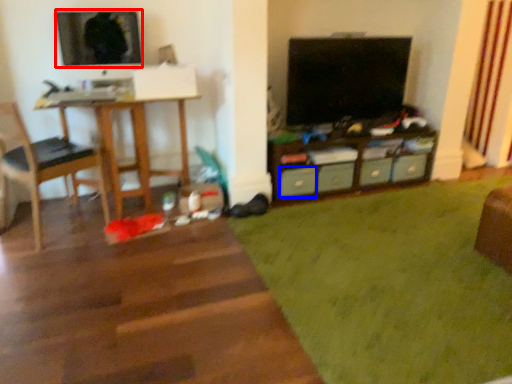
Question: Which object is further to the camera taking this photo, television (highlighted by a red box) or drawer (highlighted by a blue box)?

Choices:
 (A) television
 (B) drawer

Answer: (B)